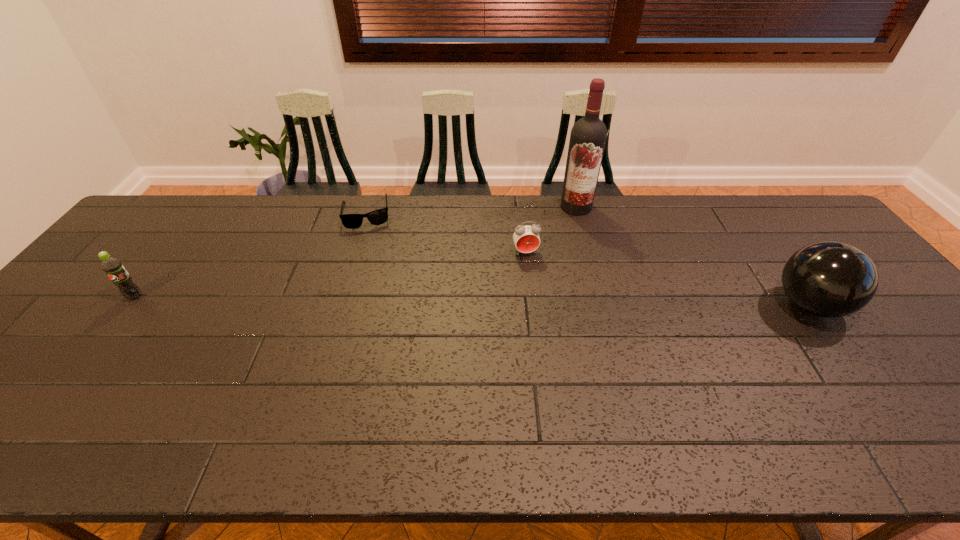
I want to click on vacant space located 0.250m on the front label of the soda, so click(68, 383).

Locate an element on the screen. The image size is (960, 540). vacant space positioned on the surface of the second tallest object near the finger holes is located at coordinates tap(867, 305).

Where is `vacant space located 0.110m on the label of the tallest object`? The width and height of the screenshot is (960, 540). vacant space located 0.110m on the label of the tallest object is located at coordinates (560, 233).

You are a GUI agent. You are given a task and a screenshot of the screen. Output one action in this format:
    pyautogui.click(x=<x>, y=<y>)
    Task: Click on the free location located 0.260m on the label of the tallest object
    The height and width of the screenshot is (540, 960).
    Given the screenshot: What is the action you would take?
    coord(542,262)

Find the location of a particular element. This screenshot has width=960, height=540. free space located on the label of the tallest object is located at coordinates (531, 281).

I want to click on free space located 0.240m on the front-facing side of the second object from left to right, so click(376, 281).

Find the location of a particular element. free location located on the front-facing side of the second object from left to right is located at coordinates (379, 296).

This screenshot has height=540, width=960. Find the location of `vacant space located on the front-facing side of the second object from left to right`. vacant space located on the front-facing side of the second object from left to right is located at coordinates (375, 276).

What are the coordinates of `free location located 0.090m on the face of the third object from right to left` in the screenshot? It's located at (533, 279).

Identify the location of free space located on the face of the third object from right to left. (536, 292).